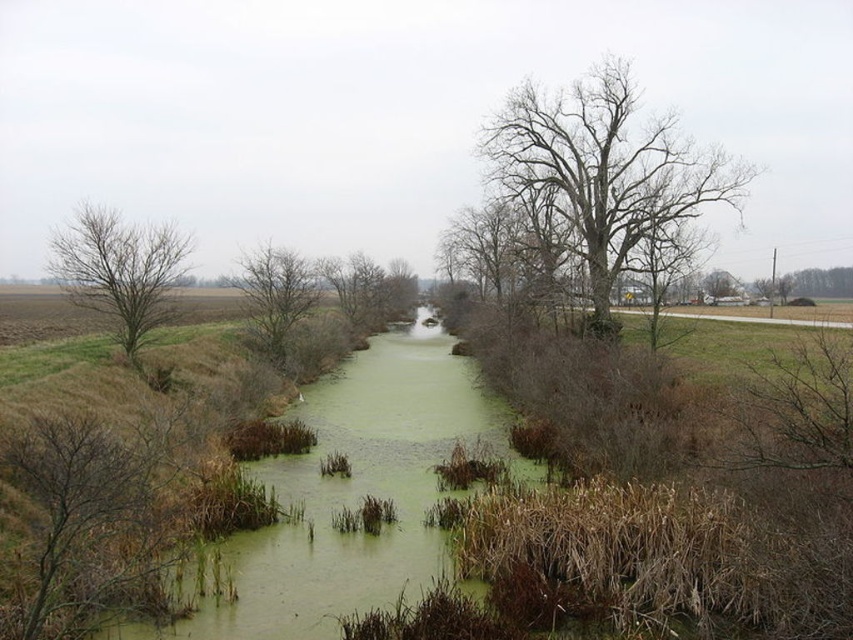
You are standing at the center of the waterway in the image and looking towards the upper part of the scene. Which object is located at the coordinate point (607, 172)?

The point (607, 172) indicates the location of the bare branches tree at upper center.